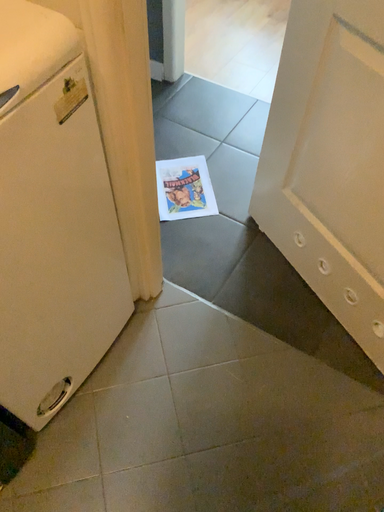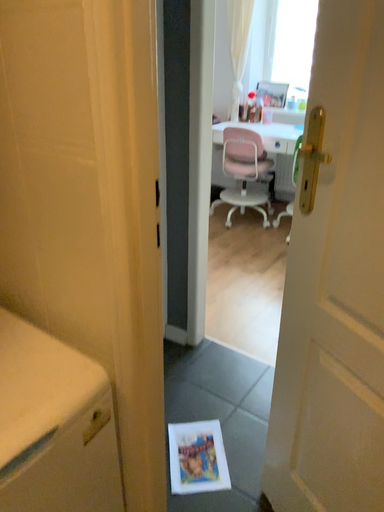
Question: How did the camera likely rotate when shooting the video?

Choices:
 (A) rotated upward
 (B) rotated downward

Answer: (A)